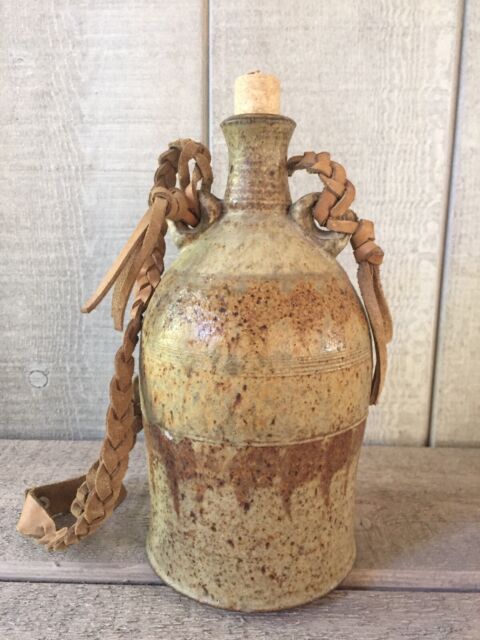
Find the location of a particular element. This screenshot has width=480, height=640. cork is located at coordinates (256, 100).